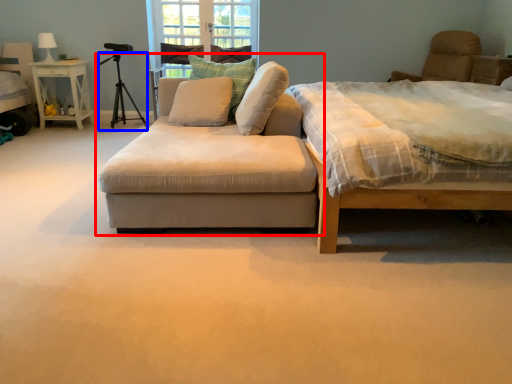
Question: Which object appears farthest to the camera in this image, studio couch (highlighted by a red box) or tripod (highlighted by a blue box)?

Choices:
 (A) studio couch
 (B) tripod

Answer: (B)